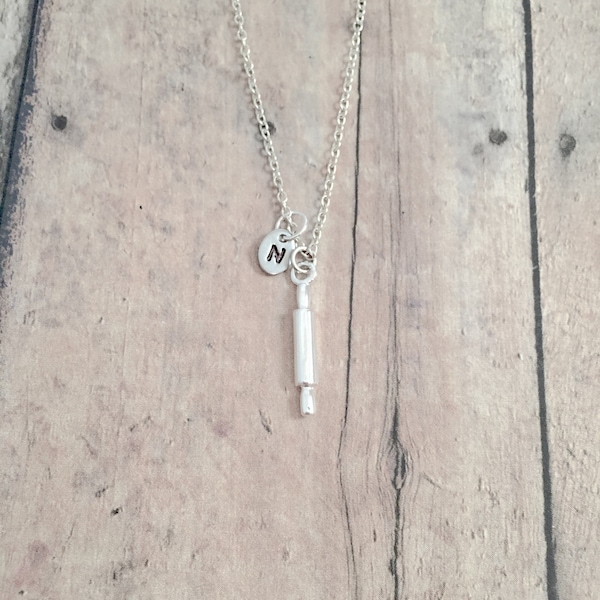
Find the location of a particular element. verticl crack in wood is located at coordinates (397, 469), (347, 283).